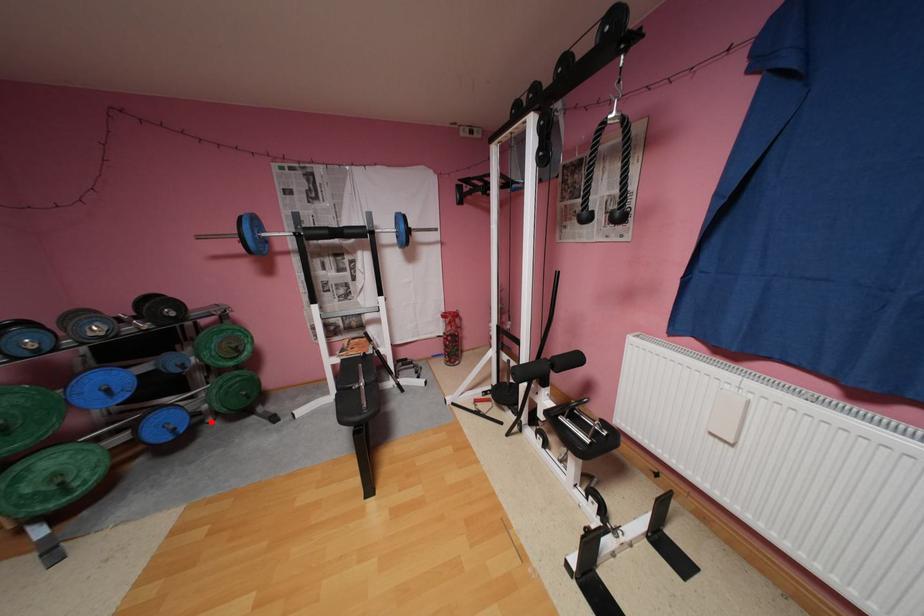
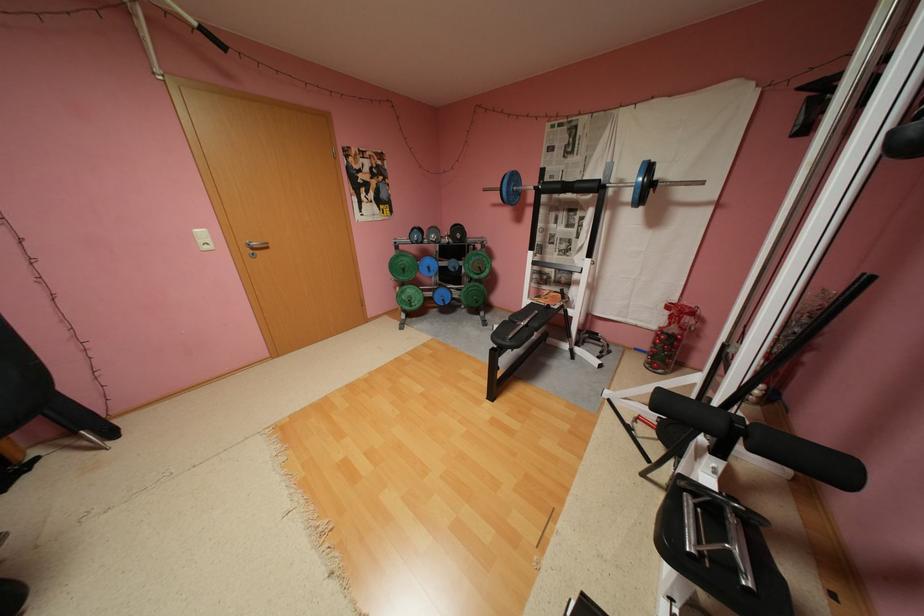
Question: I am providing you with two images of the same scene from different viewpoints. In image1, a red point is highlighted. Considering the same 3D point in image2, which of the following is correct?

Choices:
 (A) It is closer
 (B) It is farther

Answer: (A)